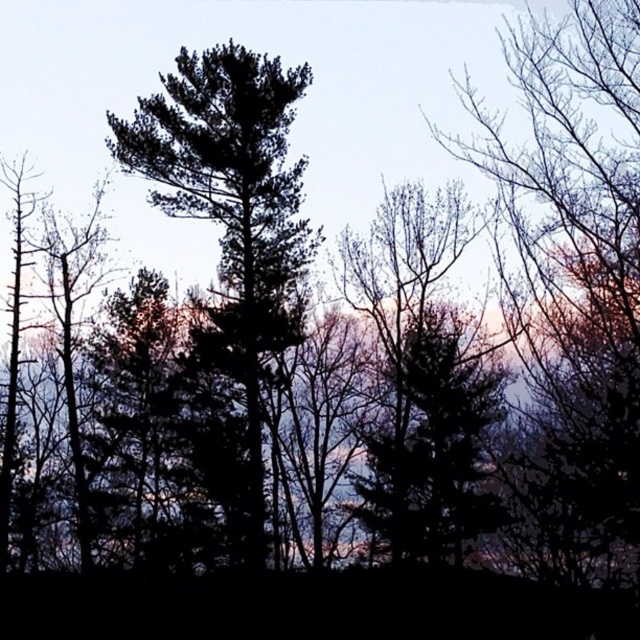
Question: In this image, where is silvery bark tree at right located relative to dark green textured tree at center?

Choices:
 (A) below
 (B) above

Answer: (A)

Question: Which is nearer to the dark green textured tree at center?

Choices:
 (A) green leafy tree at center
 (B) silvery bark tree at right

Answer: (A)

Question: Which of the following is the farthest from the observer?

Choices:
 (A) dark green textured tree at center
 (B) green leafy tree at center

Answer: (A)

Question: Which point appears farthest from the camera in this image?

Choices:
 (A) (340, 243)
 (B) (621, 12)

Answer: (A)

Question: Can you confirm if dark green textured tree at center is positioned below green leafy tree at center?

Choices:
 (A) yes
 (B) no

Answer: (B)

Question: Observing the image, what is the correct spatial positioning of silvery bark tree at right in reference to dark green textured tree at center?

Choices:
 (A) left
 (B) right

Answer: (B)